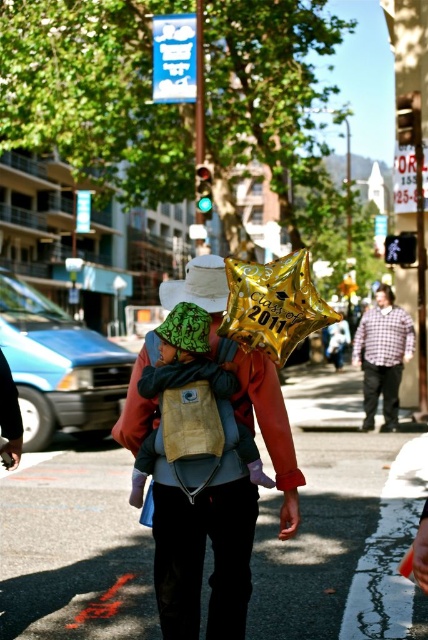
You are a photographer standing at the center of the street scene. You want to take a photo of the gold metallic balloon at center and the matte plaid shirt at center. Given that your camera has a maximum focus range of 10 meters, will both objects be in focus?

The distance between the gold metallic balloon at center and the matte plaid shirt at center is 10.09 meters. Since the camera can only focus up to 10 meters, the objects are slightly out of the focus range. Therefore, both objects cannot be in focus simultaneously.

You are a photographer trying to capture a photo of the gold metallic balloon at center and the matte plaid shirt at center. Which object should you focus on first if you want to ensure both are in focus, considering their positions relative to the camera?

The gold metallic balloon at center is shorter than the matte plaid shirt at center, so you should focus on the matte plaid shirt at center first to ensure both are in focus since it is closer to the camera.

You are a photographer trying to capture the gold metallic balloon at upper center and the matte plaid shirt at center in the same frame. Based on their positions, which object should you focus on first to ensure both are in focus?

The gold metallic balloon at upper center is below the matte plaid shirt at center, so you should focus on the matte plaid shirt at center first to ensure both are in focus.